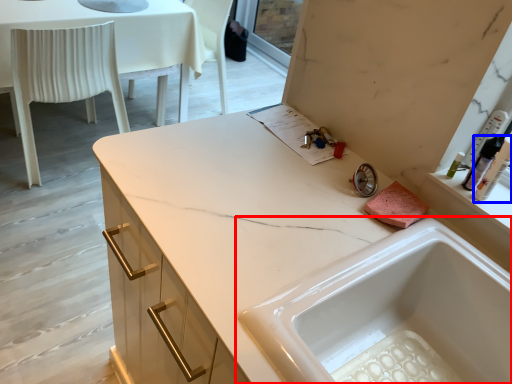
Question: Which point is further to the camera, sink (highlighted by a red box) or toiletry (highlighted by a blue box)?

Choices:
 (A) sink
 (B) toiletry

Answer: (B)